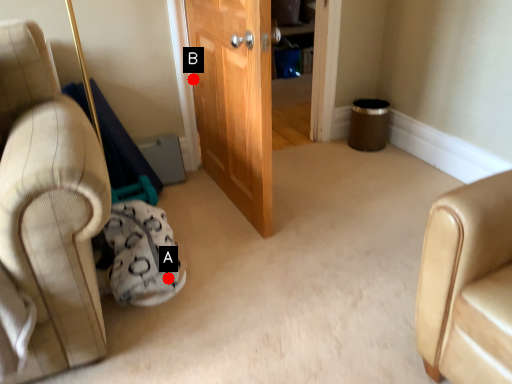
Question: Two points are circled on the image, labeled by A and B beside each circle. Which point is closer to the camera?

Choices:
 (A) A is closer
 (B) B is closer

Answer: (A)